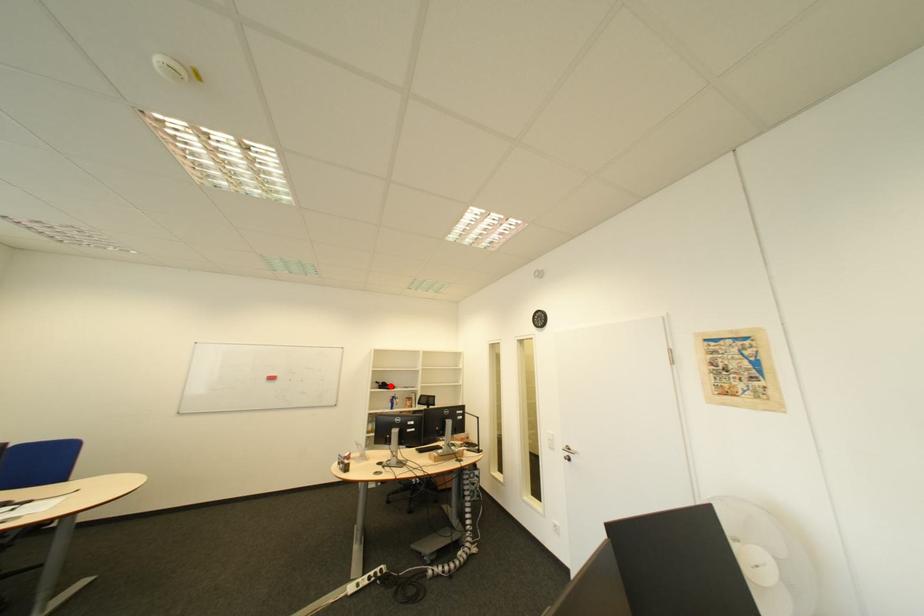
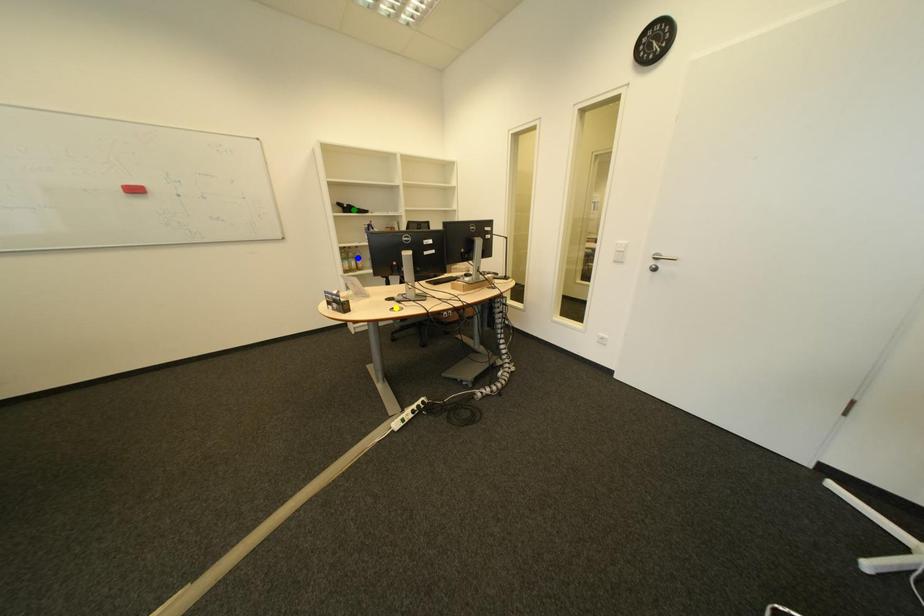
Question: I am providing you with two images of the same scene from different viewpoints. A red point is marked on the first image. You are given multiple points on the second image. Which spot in image 2 lines up with the point in image 1?

Choices:
 (A) green point
 (B) yellow point
 (C) blue point

Answer: (A)